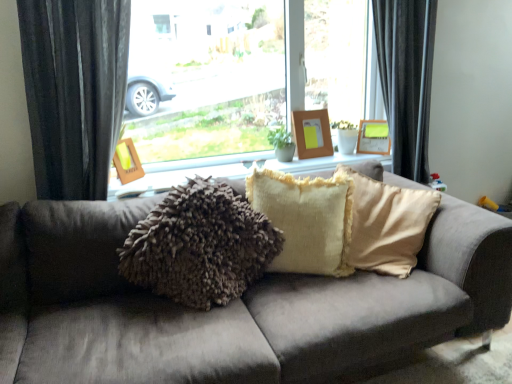
In order to click on vacant area that is in front of wooden frame at center, positioned as the 2th picture frame in front-to-back order in this screenshot , I will do `click(316, 160)`.